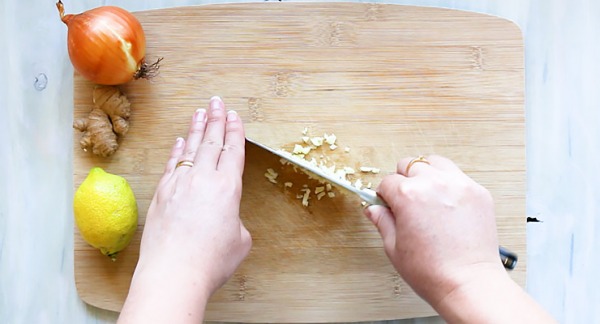
At what (x,y) coordinates should I click in order to perform the action: click on small cuts in cutting board. Please return your answer as a coordinate pair (x, y). The width and height of the screenshot is (600, 324). Looking at the image, I should click on (327, 88), (477, 60).